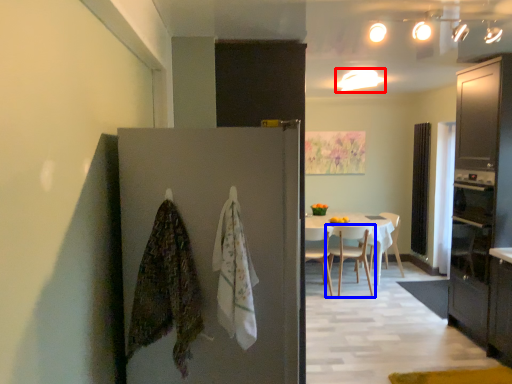
Question: Which point is closer to the camera, lighting (highlighted by a red box) or chair (highlighted by a blue box)?

Choices:
 (A) lighting
 (B) chair

Answer: (A)